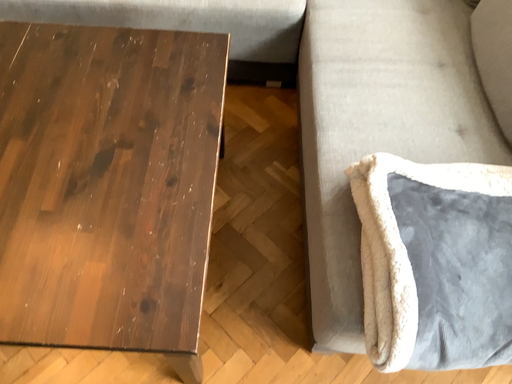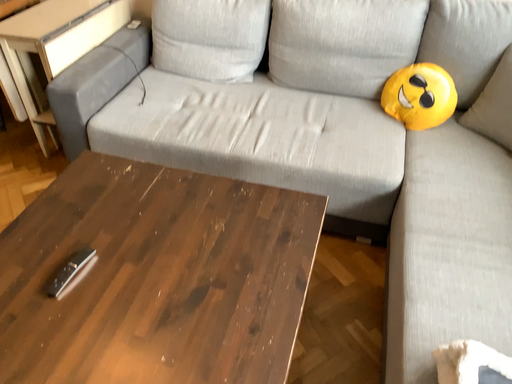
Question: Which way did the camera rotate in the video?

Choices:
 (A) rotated downward
 (B) rotated upward

Answer: (B)